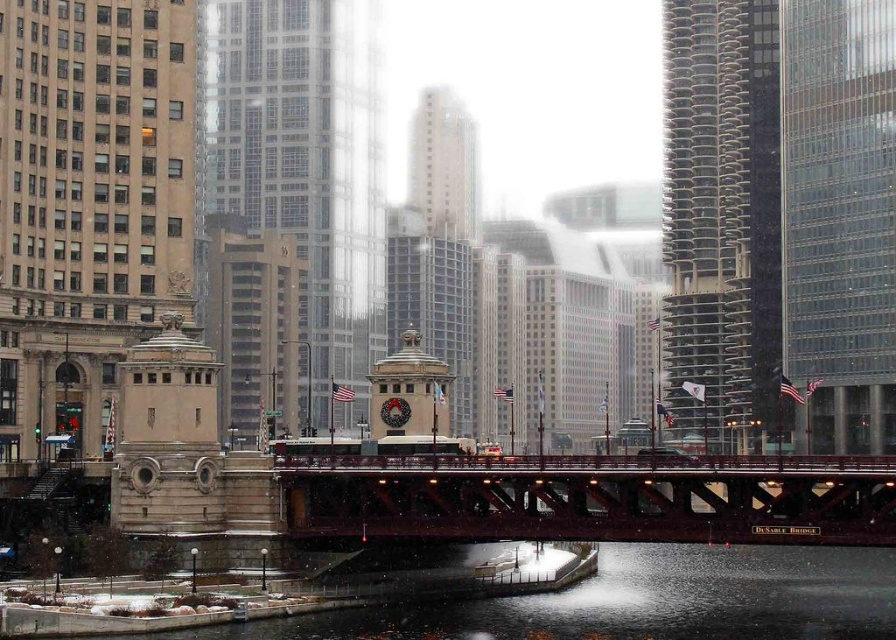
You are a drone operator trying to capture a photo of the metallic red bridge at center. The drone is currently at point 0.778, 0.662. Is the drone already positioned directly above the bridge?

The metallic red bridge at center is located at point (592, 497), so yes, the drone is already positioned directly above the bridge.

You are standing at the center of the red bridge and looking towards the upper right corner of the image. What type of building can you see at point (840,220)?

At point (840,220), there is a clear glass skyscraper at upper right.

You are a photographer trying to capture the smooth concrete river at center and the metallic red bridge at center in a single shot. Since you want the river to be clearly visible in the background, which object should you position closer to the camera?

The metallic red bridge at center should be positioned closer to the camera so that the smooth concrete river at center remains visible in the background behind it.